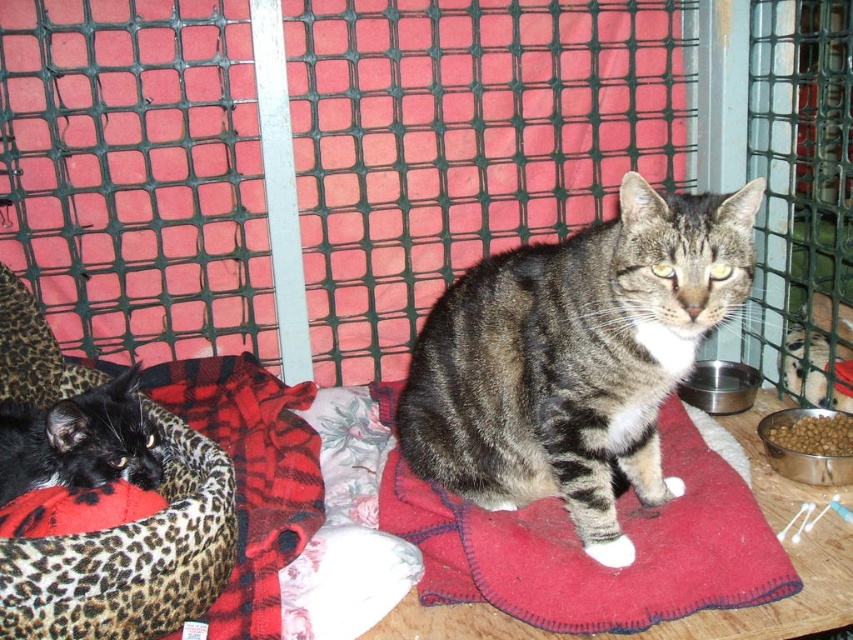
Is black fur cat at left shorter than brown matte food at lower right?

No, black fur cat at left is not shorter than brown matte food at lower right.

Between point (152, 483) and point (849, 449), which one is positioned in front?

Point (152, 483) is more forward.

Find the location of a particular element. The width and height of the screenshot is (853, 640). black fur cat at left is located at coordinates (79, 440).

Between point (521, 538) and point (817, 426), which one is positioned in front?

Point (521, 538)

Which is behind, point (573, 612) or point (791, 436)?

The point (791, 436) is more distant.

Where is `soft woolen mat at center`? soft woolen mat at center is located at coordinates [x=590, y=560].

Can you confirm if tabby fur cat at center is positioned to the left of black fur cat at left?

In fact, tabby fur cat at center is to the right of black fur cat at left.

Who is more distant from viewer, (x=601, y=234) or (x=48, y=440)?

The point (x=601, y=234) is behind.

Where is `tabby fur cat at center`? tabby fur cat at center is located at coordinates (575, 356).